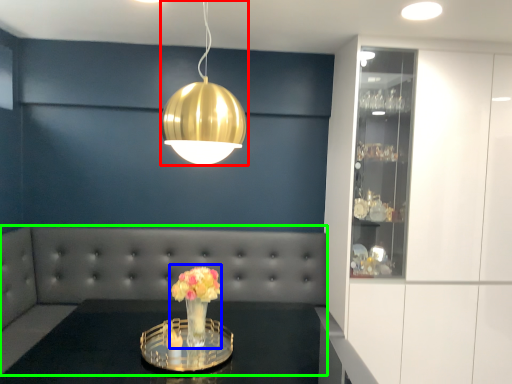
Question: Which object is positioned farthest from lamp (highlighted by a red box)? Select from floral arrangement (highlighted by a blue box) and couch (highlighted by a green box).

Choices:
 (A) floral arrangement
 (B) couch

Answer: (B)